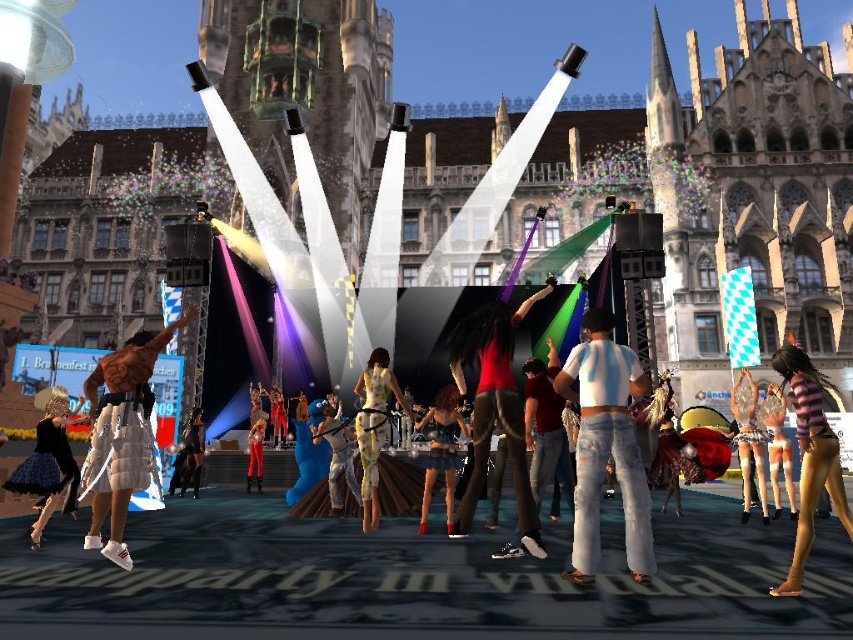
Question: Among these objects, which one is nearest to the camera?

Choices:
 (A) matte red shirt at center
 (B) denim pants at center
 (C) shiny silver dress at center
 (D) striped fabric pants at lower right

Answer: (D)

Question: Considering the real-world distances, which object is closest to the white distressed jeans at center?

Choices:
 (A) black satin skirt at lower left
 (B) striped fabric pants at lower right
 (C) floral fabric dress at center
 (D) white sequined skirt at center

Answer: (B)

Question: Considering the real-world distances, which object is closest to the striped fabric pants at lower right?

Choices:
 (A) white distressed jeans at center
 (B) shiny metallic shorts at lower right
 (C) matte red shirt at center
 (D) denim pants at center

Answer: (B)

Question: Is matte red shirt at center positioned behind denim pants at center?

Choices:
 (A) yes
 (B) no

Answer: (B)

Question: Where is white sequined skirt at center located in relation to striped fabric pants at lower right in the image?

Choices:
 (A) left
 (B) right

Answer: (A)

Question: Is black satin skirt at lower left to the right of striped fabric dress at lower right from the viewer's perspective?

Choices:
 (A) no
 (B) yes

Answer: (A)